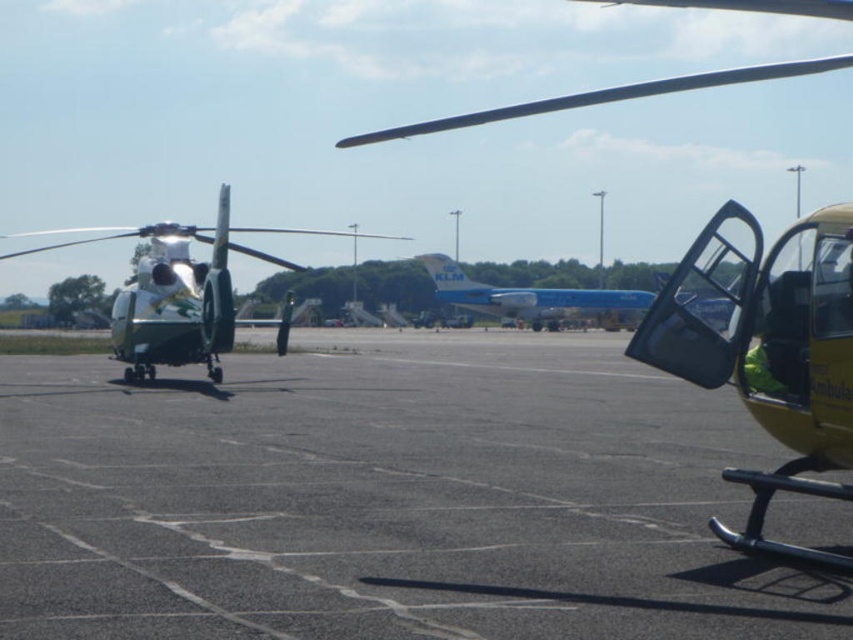
Is yellow matte helicopter at right to the right of white glossy helmet at center from the viewer's perspective?

Correct, you'll find yellow matte helicopter at right to the right of white glossy helmet at center.

Between yellow matte helicopter at right and white glossy helmet at center, which one has less height?

white glossy helmet at center

This screenshot has height=640, width=853. What are the coordinates of `yellow matte helicopter at right` in the screenshot? It's located at (769, 356).

Locate an element on the screen. black asphalt tarmac at center is located at coordinates (386, 499).

What do you see at coordinates (386, 499) in the screenshot?
I see `black asphalt tarmac at center` at bounding box center [386, 499].

Which is behind, point (265, 577) or point (631, 321)?

Point (631, 321)

Find the location of `black asphalt tarmac at center`. black asphalt tarmac at center is located at coordinates (386, 499).

Can you confirm if blue glossy airplane at center is taller than white glossy helmet at center?

Yes.

Does blue glossy airplane at center appear over white glossy helmet at center?

Indeed, blue glossy airplane at center is positioned over white glossy helmet at center.

Locate an element on the screen. blue glossy airplane at center is located at coordinates (532, 298).